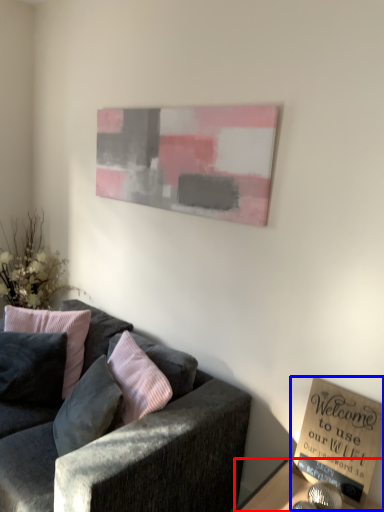
Question: Which object appears closest to the camera in this image, table (highlighted by a red box) or book (highlighted by a blue box)?

Choices:
 (A) table
 (B) book

Answer: (A)